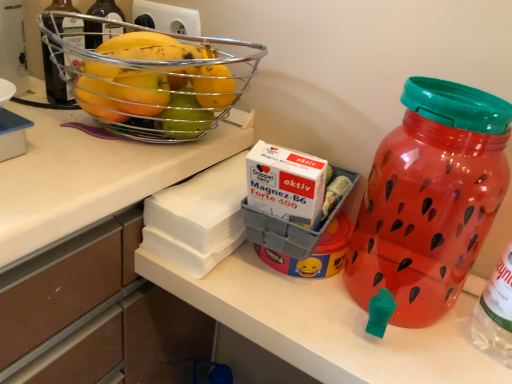
Question: Does metallic wire basket at upper left have a greater width compared to translucent plastic water jug at right?

Choices:
 (A) yes
 (B) no

Answer: (A)

Question: Considering the relative sizes of metallic wire basket at upper left and translucent plastic water jug at right in the image provided, is metallic wire basket at upper left shorter than translucent plastic water jug at right?

Choices:
 (A) no
 (B) yes

Answer: (B)

Question: Is metallic wire basket at upper left not close to translucent plastic water jug at right?

Choices:
 (A) yes
 (B) no

Answer: (B)

Question: Is metallic wire basket at upper left positioned with its back to translucent plastic water jug at right?

Choices:
 (A) yes
 (B) no

Answer: (B)

Question: From the image's perspective, is metallic wire basket at upper left located beneath translucent plastic water jug at right?

Choices:
 (A) no
 (B) yes

Answer: (A)

Question: Does metallic wire basket at upper left come in front of translucent plastic water jug at right?

Choices:
 (A) yes
 (B) no

Answer: (B)

Question: Can you confirm if translucent plastic water jug at right is thinner than metallic wire basket at upper left?

Choices:
 (A) no
 (B) yes

Answer: (B)

Question: Does translucent plastic water jug at right have a larger size compared to metallic wire basket at upper left?

Choices:
 (A) no
 (B) yes

Answer: (A)

Question: Is translucent plastic water jug at right smaller than metallic wire basket at upper left?

Choices:
 (A) no
 (B) yes

Answer: (B)

Question: Does translucent plastic water jug at right have a greater width compared to metallic wire basket at upper left?

Choices:
 (A) no
 (B) yes

Answer: (A)

Question: Considering the relative sizes of translucent plastic water jug at right and metallic wire basket at upper left in the image provided, is translucent plastic water jug at right taller than metallic wire basket at upper left?

Choices:
 (A) no
 (B) yes

Answer: (B)

Question: Are translucent plastic water jug at right and metallic wire basket at upper left far apart?

Choices:
 (A) no
 (B) yes

Answer: (A)

Question: Would you say translucent plastic water jug at right is to the left or to the right of metallic wire basket at upper left in the picture?

Choices:
 (A) right
 (B) left

Answer: (A)